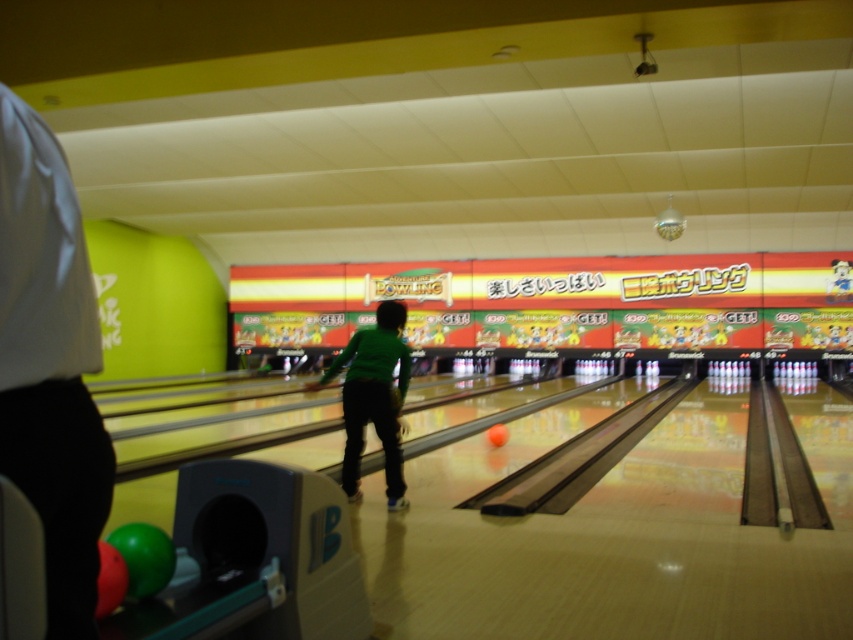
Does white fabric shirt at left appear under green matte shirt at center?

Actually, white fabric shirt at left is above green matte shirt at center.

Is white fabric shirt at left smaller than green matte shirt at center?

Correct, white fabric shirt at left occupies less space than green matte shirt at center.

Between point (47, 152) and point (380, 317), which one is positioned in front?

Point (47, 152)

The image size is (853, 640). What are the coordinates of `white fabric shirt at left` in the screenshot? It's located at (50, 364).